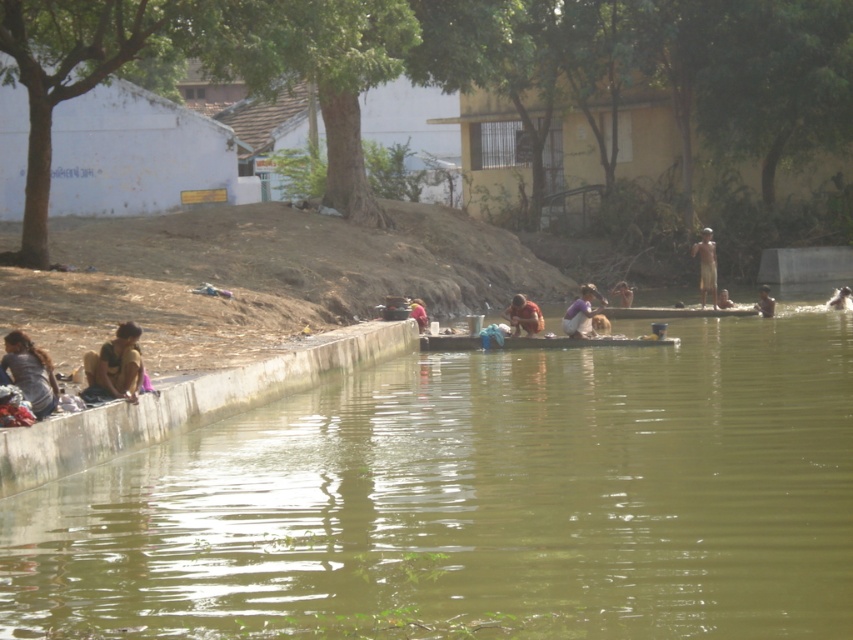
Question: Does light brown skin at center appear over orange fabric at center?

Choices:
 (A) no
 (B) yes

Answer: (B)

Question: Does brown textured cloth at center appear under orange fabric person at center?

Choices:
 (A) yes
 (B) no

Answer: (B)

Question: Can you confirm if concrete ledge at lower left is positioned above orange fabric at center?

Choices:
 (A) yes
 (B) no

Answer: (B)

Question: Considering the real-world distances, which object is farthest from the orange fabric at center?

Choices:
 (A) green murky water at center
 (B) brown fabric cloth at lower left

Answer: (B)

Question: Based on their relative distances, which object is nearer to the light brown skin at center?

Choices:
 (A) concrete ledge at lower left
 (B) light brown skin at upper right
 (C) brown fabric cloth at lower left

Answer: (B)

Question: Which is nearer to the dark gray fabric at lower left?

Choices:
 (A) brown fabric cloth at lower left
 (B) orange fabric person at center
 (C) green murky water at center

Answer: (A)